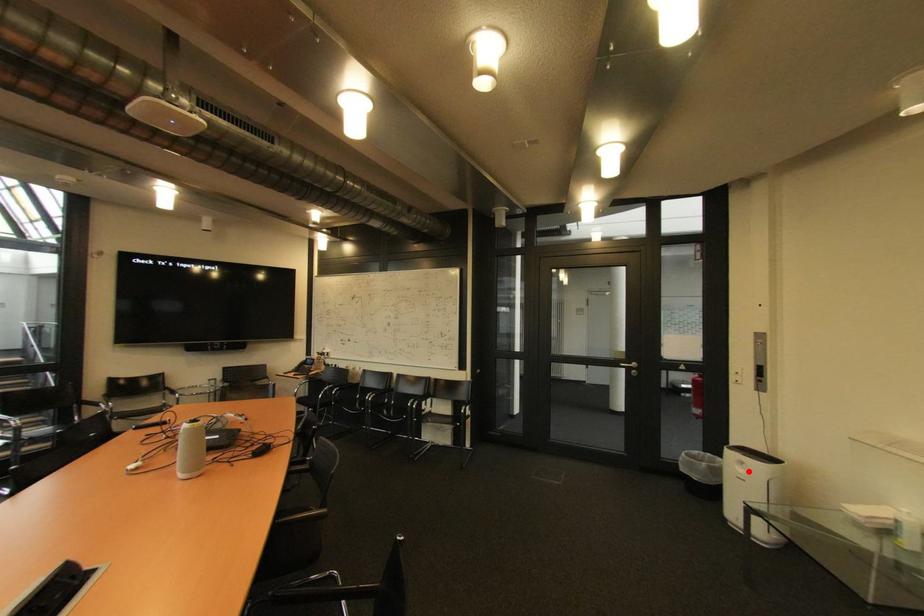
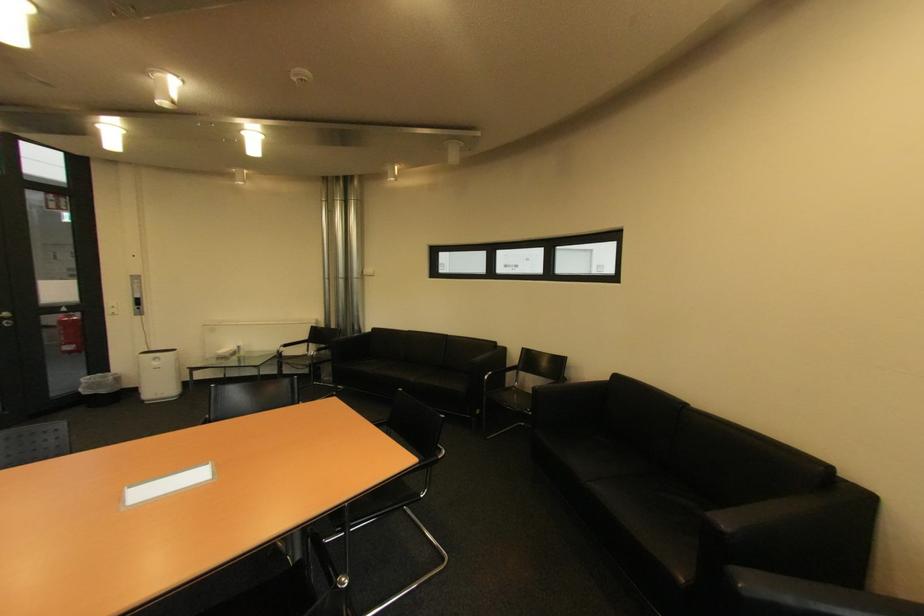
Locate, in the second image, the point that corresponds to the highlighted location in the first image.

(164, 363)